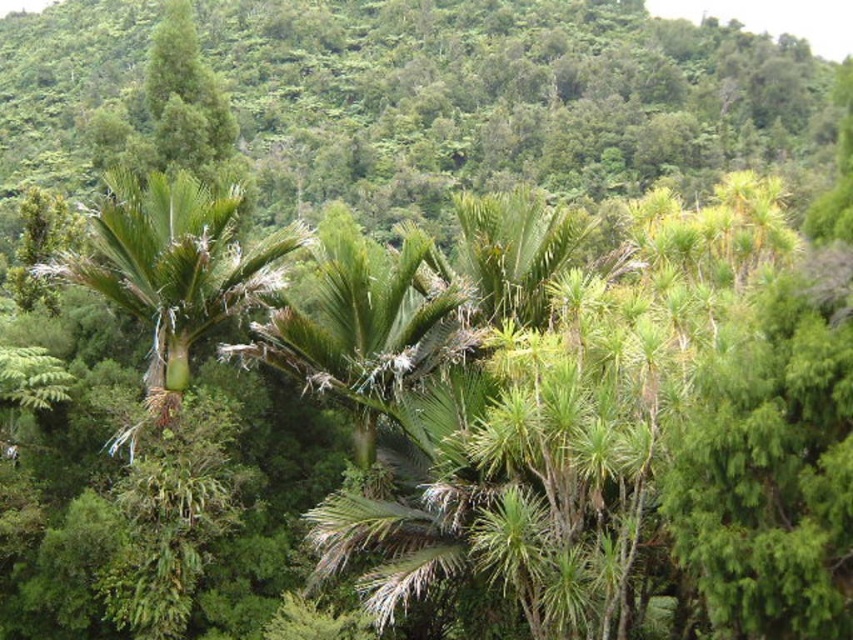
You are a botanist studying palm trees in this tropical landscape. You observe the green leafy palm at left and the green leafy palm tree at center. Which palm is closer to the front of the image?

The green leafy palm at left is positioned over the green leafy palm tree at center, meaning it is closer to the front of the image.

You are standing in the lush landscape and want to walk from the point at coordinates point (157, 232) to the point at coordinates point (412, 355). Which direction should you move to get closer to your destination?

To move from point (157, 232) to point (412, 355), you should move towards the upper right direction since point (412, 355) is located at a higher coordinate in both the x and y axes compared to point (157, 232).